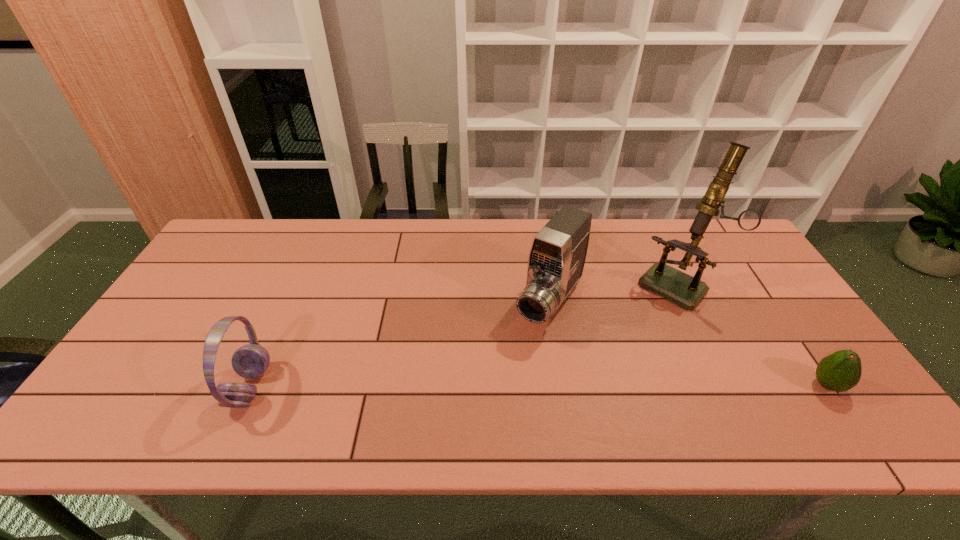
The image size is (960, 540). Identify the location of object located at the near right corner. (840, 371).

In the image, there is a desktop. Identify the location of free space at the far edge. The image size is (960, 540). (468, 231).

The image size is (960, 540). What are the coordinates of `vacant point at the near edge` in the screenshot? It's located at (196, 376).

Where is `vacant space at the left edge`? The width and height of the screenshot is (960, 540). vacant space at the left edge is located at coordinates [162, 337].

The height and width of the screenshot is (540, 960). I want to click on free region at the right edge of the desktop, so click(736, 297).

The image size is (960, 540). Find the location of `vacant region at the far left corner of the desktop`. vacant region at the far left corner of the desktop is located at coordinates (213, 254).

I want to click on vacant point at the near right corner, so click(801, 381).

Locate an element on the screen. empty space that is in between the camcorder and the tallest object is located at coordinates (612, 294).

What are the coordinates of `free space that is in between the leftmost object and the microscope` in the screenshot? It's located at (463, 336).

Find the location of a particular element. free space between the third tallest object and the rightmost object is located at coordinates (539, 386).